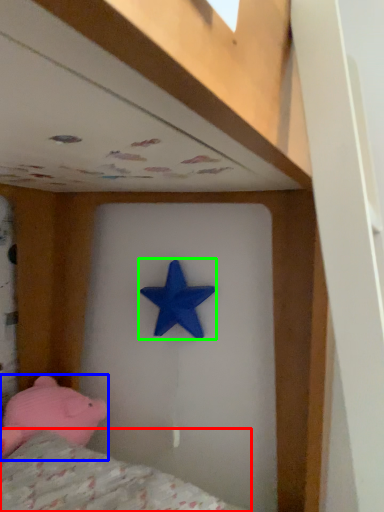
Question: Considering the real-world distances, which object is closest to mattress (highlighted by a red box)? toy (highlighted by a blue box) or starfish (highlighted by a green box).

Choices:
 (A) toy
 (B) starfish

Answer: (A)